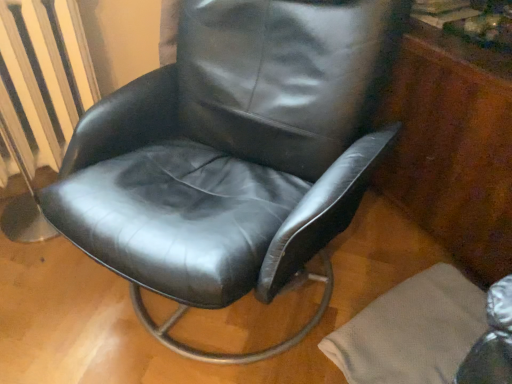
Question: Is black leather chair at center thinner than mahogany wood dresser at right?

Choices:
 (A) no
 (B) yes

Answer: (A)

Question: Can you confirm if black leather chair at center is shorter than mahogany wood dresser at right?

Choices:
 (A) yes
 (B) no

Answer: (B)

Question: From the image's perspective, does black leather chair at center appear higher than mahogany wood dresser at right?

Choices:
 (A) yes
 (B) no

Answer: (B)

Question: From a real-world perspective, is black leather chair at center below mahogany wood dresser at right?

Choices:
 (A) no
 (B) yes

Answer: (A)

Question: Does black leather chair at center have a greater width compared to mahogany wood dresser at right?

Choices:
 (A) yes
 (B) no

Answer: (A)

Question: Considering the relative sizes of black leather chair at center and mahogany wood dresser at right in the image provided, is black leather chair at center smaller than mahogany wood dresser at right?

Choices:
 (A) no
 (B) yes

Answer: (A)

Question: Can you confirm if mahogany wood dresser at right is taller than black leather chair at center?

Choices:
 (A) no
 (B) yes

Answer: (A)

Question: Is mahogany wood dresser at right positioned beyond the bounds of black leather chair at center?

Choices:
 (A) yes
 (B) no

Answer: (A)

Question: From a real-world perspective, is mahogany wood dresser at right under black leather chair at center?

Choices:
 (A) no
 (B) yes

Answer: (B)

Question: Is mahogany wood dresser at right shorter than black leather chair at center?

Choices:
 (A) yes
 (B) no

Answer: (A)

Question: From the image's perspective, is mahogany wood dresser at right below black leather chair at center?

Choices:
 (A) no
 (B) yes

Answer: (A)

Question: From the image's perspective, is mahogany wood dresser at right on top of black leather chair at center?

Choices:
 (A) no
 (B) yes

Answer: (B)

Question: Considering the relative sizes of metallic silver radiator at left and black leather chair at center in the image provided, is metallic silver radiator at left wider than black leather chair at center?

Choices:
 (A) yes
 (B) no

Answer: (B)